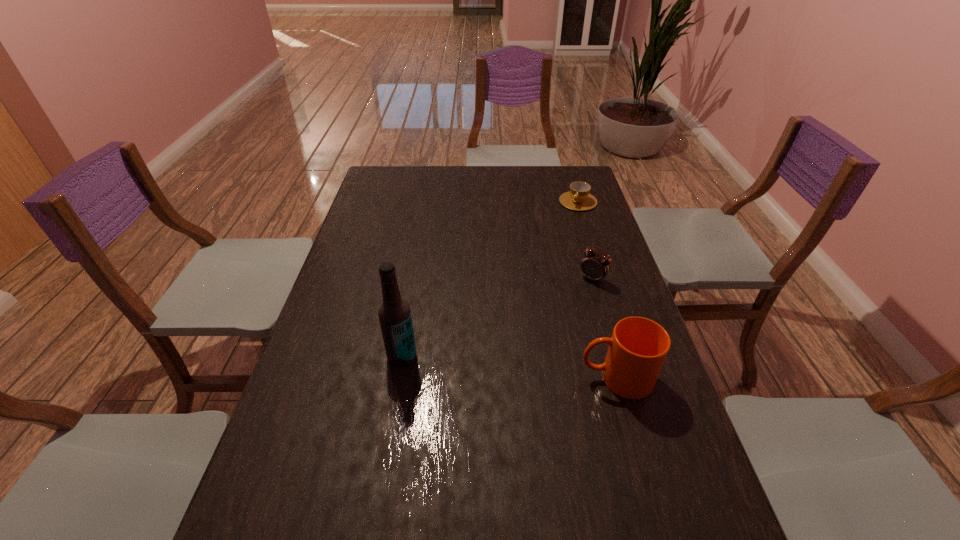
This screenshot has width=960, height=540. I want to click on free space between the shortest object and the tallest object, so click(x=490, y=279).

Locate an element on the screen. This screenshot has height=540, width=960. vacant region between the mug and the third nearest object is located at coordinates (605, 328).

Find the location of a particular element. Image resolution: width=960 pixels, height=540 pixels. empty space that is in between the third shortest object and the beer bottle is located at coordinates (509, 367).

Image resolution: width=960 pixels, height=540 pixels. Identify the location of free space between the farthest object and the mug. (597, 290).

Find the location of a particular element. The image size is (960, 540). free space between the second shortest object and the farthest object is located at coordinates (586, 240).

Select which object is the third closest to the farthest object. Please provide its 2D coordinates. Your answer should be formatted as a tuple, i.e. [(x, y)], where the tuple contains the x and y coordinates of a point satisfying the conditions above.

[(394, 313)]

Where is `the third closest object relative to the alarm clock`? This screenshot has height=540, width=960. the third closest object relative to the alarm clock is located at coordinates (394, 313).

This screenshot has height=540, width=960. In order to click on free space in the image that satisfies the following two spatial constraints: 1. on the side of the mug with the label; 2. on the handle side of the tallest object in this screenshot , I will do `click(398, 378)`.

At what (x,y) coordinates should I click in order to perform the action: click on free location that satisfies the following two spatial constraints: 1. on the side of the beer bottle with the label; 2. on the handle side of the second tallest object. Please return your answer as a coordinate pair (x, y). This screenshot has width=960, height=540. Looking at the image, I should click on (398, 378).

I want to click on vacant area in the image that satisfies the following two spatial constraints: 1. on the side of the beer bottle with the label; 2. on the handle side of the third shortest object, so click(x=398, y=378).